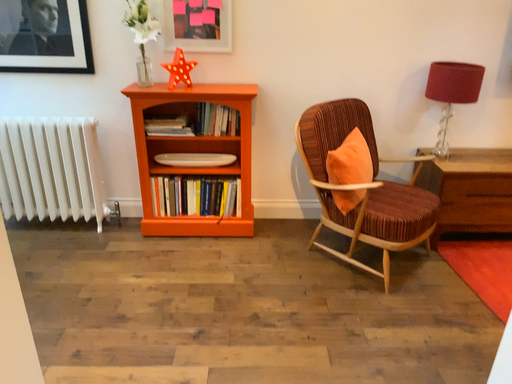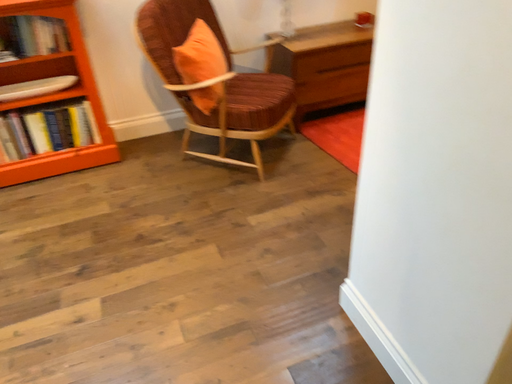
Question: Which way did the camera rotate in the video?

Choices:
 (A) rotated downward
 (B) rotated upward

Answer: (A)